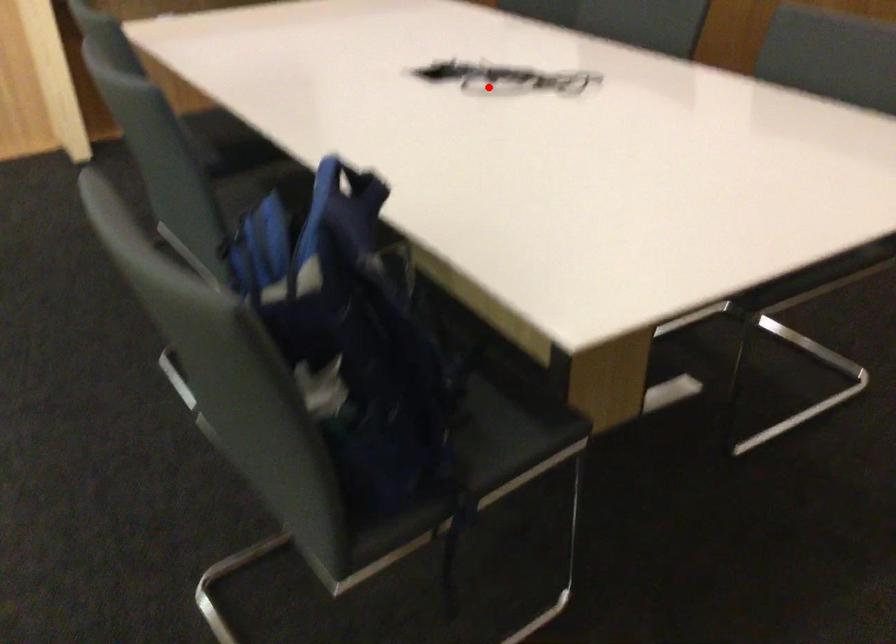
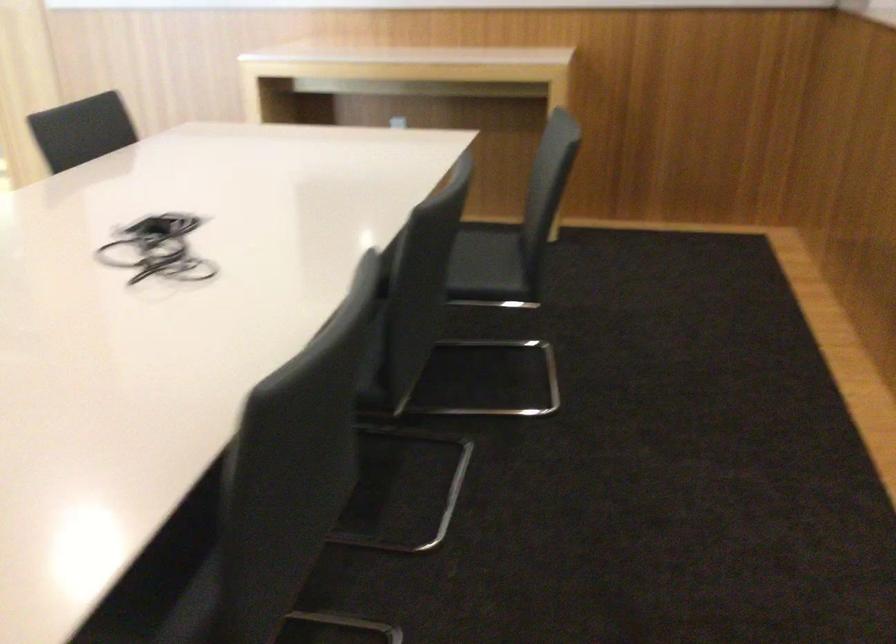
Question: I am providing you with two images of the same scene from different viewpoints. A red point is marked on the first image. At the location where the point appears in image 1, is it still visible in image 2?

Choices:
 (A) Yes
 (B) No

Answer: (A)